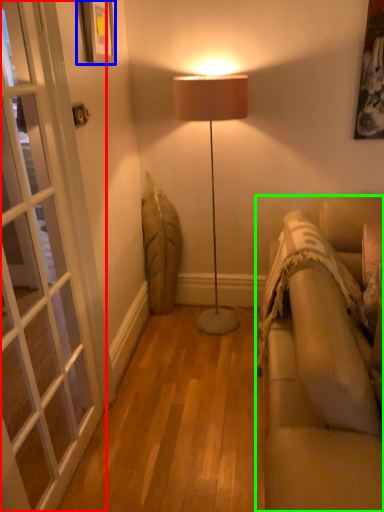
Question: Which object is the closest to the screen door (highlighted by a red box)? Choose among these: picture frame (highlighted by a blue box) or studio couch (highlighted by a green box).

Choices:
 (A) picture frame
 (B) studio couch

Answer: (A)